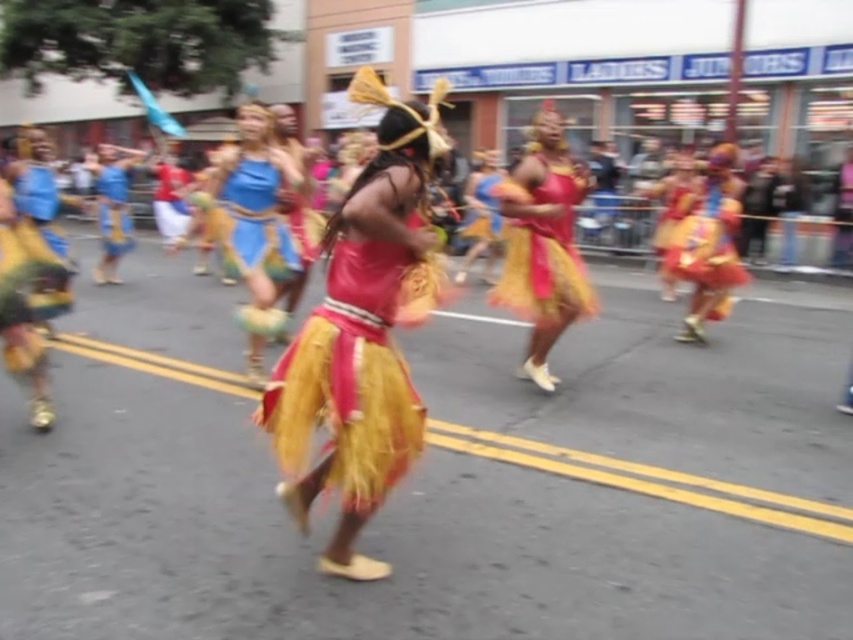
Question: Which point is farther to the camera?

Choices:
 (A) matte blue fabric dress at center
 (B) shiny gold skirt at center
 (C) matte blue fabric skirt at center

Answer: (C)

Question: Does matte blue fabric skirt at center appear over matte blue shorts at center?

Choices:
 (A) no
 (B) yes

Answer: (A)

Question: Which point appears farthest from the camera in this image?

Choices:
 (A) (236, 152)
 (B) (105, 179)
 (C) (732, 227)

Answer: (B)

Question: Is shiny red fabric skirt at center closer to the viewer compared to matte blue fabric dress at center?

Choices:
 (A) no
 (B) yes

Answer: (B)

Question: Can you confirm if matte blue fabric dress at center is wider than matte blue shorts at center?

Choices:
 (A) yes
 (B) no

Answer: (B)

Question: Which point is closer to the camera?

Choices:
 (A) (113, 220)
 (B) (277, 177)
 (C) (289, 161)
 (D) (538, 182)

Answer: (D)